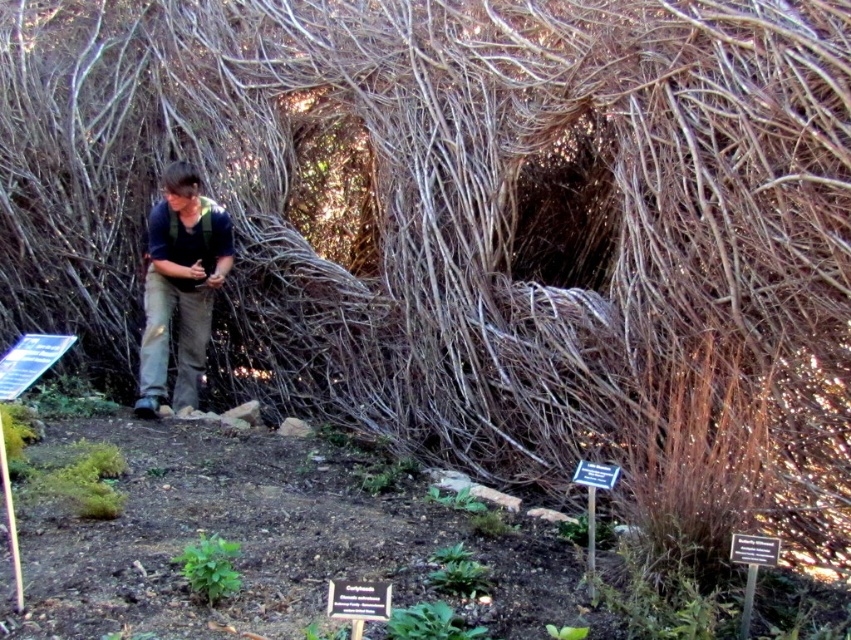
Consider the image. How far apart are green leafy plant at lower left and green leafy plant at lower center?

The distance of green leafy plant at lower left from green leafy plant at lower center is 21.55 inches.

Does point (221, 588) come closer to viewer compared to point (466, 628)?

No, (221, 588) is behind (466, 628).

In order to click on green leafy plant at lower left in this screenshot , I will do `click(210, 566)`.

Locate an element on the screen. The width and height of the screenshot is (851, 640). green leafy plant at lower left is located at coordinates (210, 566).

Is point (203, 356) farther from viewer compared to point (192, 563)?

That is True.

Between brown cotton pants at center and green leafy plant at lower left, which one is positioned higher?

Positioned higher is brown cotton pants at center.

Does point (152, 323) come in front of point (192, 572)?

No, it is not.

Locate an element on the screen. brown cotton pants at center is located at coordinates (180, 288).

Is point (164, 358) farther from viewer compared to point (413, 620)?

Yes, it is behind point (413, 620).

Does brown cotton pants at center have a smaller size compared to green leafy plant at lower center?

Actually, brown cotton pants at center might be larger than green leafy plant at lower center.

Is point (181, 275) positioned after point (397, 609)?

Yes, point (181, 275) is farther from viewer.

Where is `brown cotton pants at center`? brown cotton pants at center is located at coordinates [180, 288].